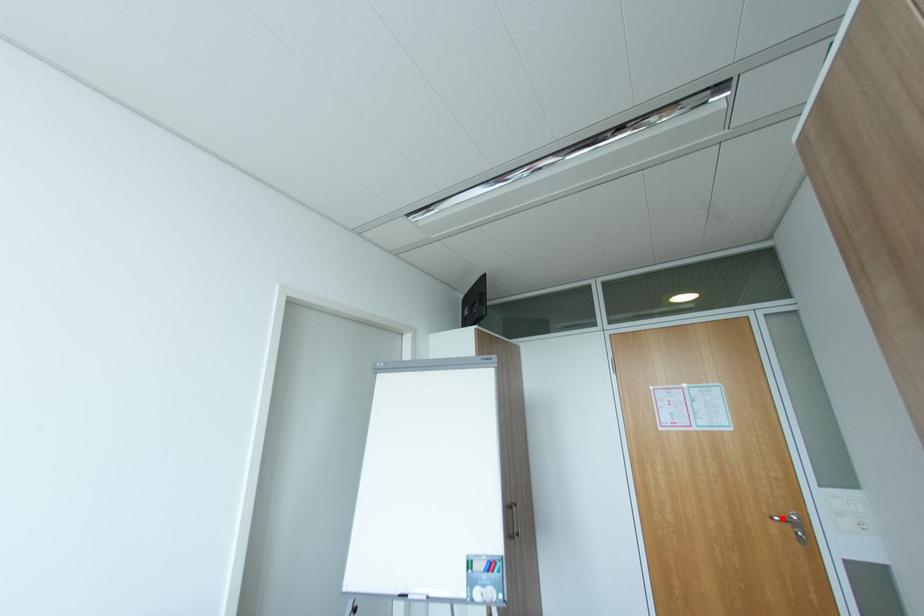
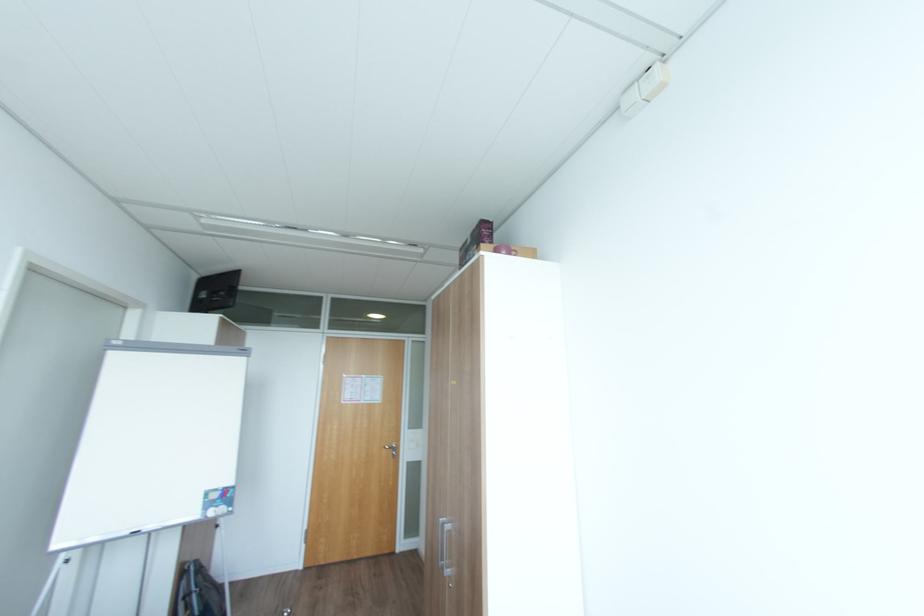
Locate, in the second image, the point that corresponds to the highlighted location in the first image.

(392, 448)